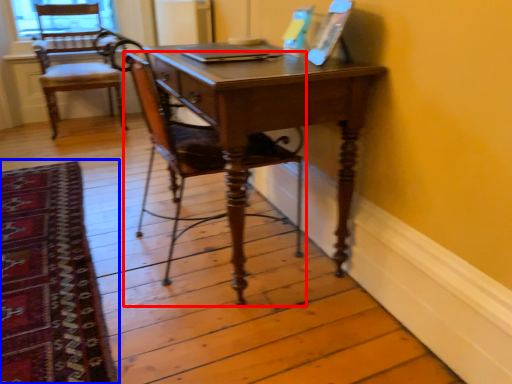
Question: Among these objects, which one is nearest to the camera, chair (highlighted by a red box) or mat (highlighted by a blue box)?

Choices:
 (A) chair
 (B) mat

Answer: (B)